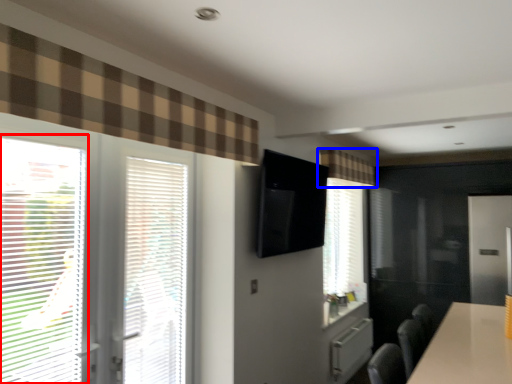
Question: Which of the following is the closest to the observer, window (highlighted by a red box) or curtain (highlighted by a blue box)?

Choices:
 (A) window
 (B) curtain

Answer: (A)